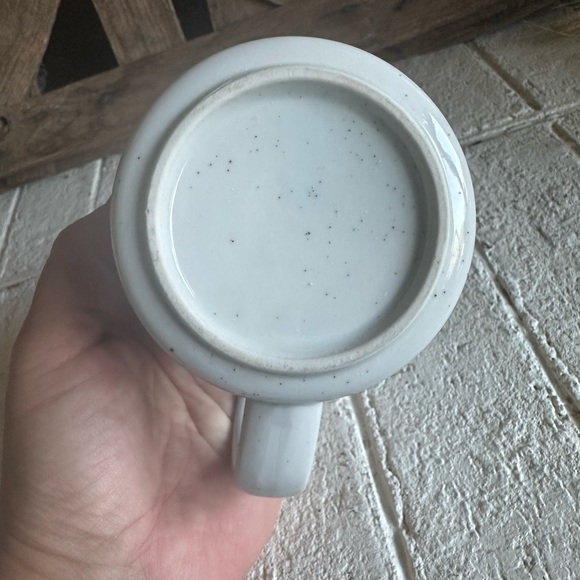
I want to click on wooden board, so click(79, 153).